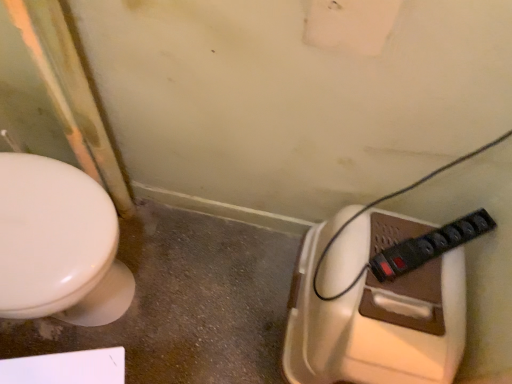
Question: Considering the positions of point (431, 235) and point (398, 221), is point (431, 235) closer or farther from the camera than point (398, 221)?

Choices:
 (A) farther
 (B) closer

Answer: (B)

Question: Considering their positions, is black plastic power strip at lower right located in front of or behind brown plastic toilet at lower right?

Choices:
 (A) front
 (B) behind

Answer: (B)

Question: From the image's perspective, is black plastic power strip at lower right located above or below brown plastic toilet at lower right?

Choices:
 (A) above
 (B) below

Answer: (A)

Question: From the image's perspective, is brown plastic toilet at lower right positioned above or below black plastic power strip at lower right?

Choices:
 (A) above
 (B) below

Answer: (B)

Question: Is brown plastic toilet at lower right to the left or to the right of black plastic power strip at lower right in the image?

Choices:
 (A) right
 (B) left

Answer: (B)

Question: From a real-world perspective, relative to black plastic power strip at lower right, is brown plastic toilet at lower right vertically above or below?

Choices:
 (A) below
 (B) above

Answer: (A)

Question: Which is correct: brown plastic toilet at lower right is inside black plastic power strip at lower right, or outside of it?

Choices:
 (A) inside
 (B) outside

Answer: (B)